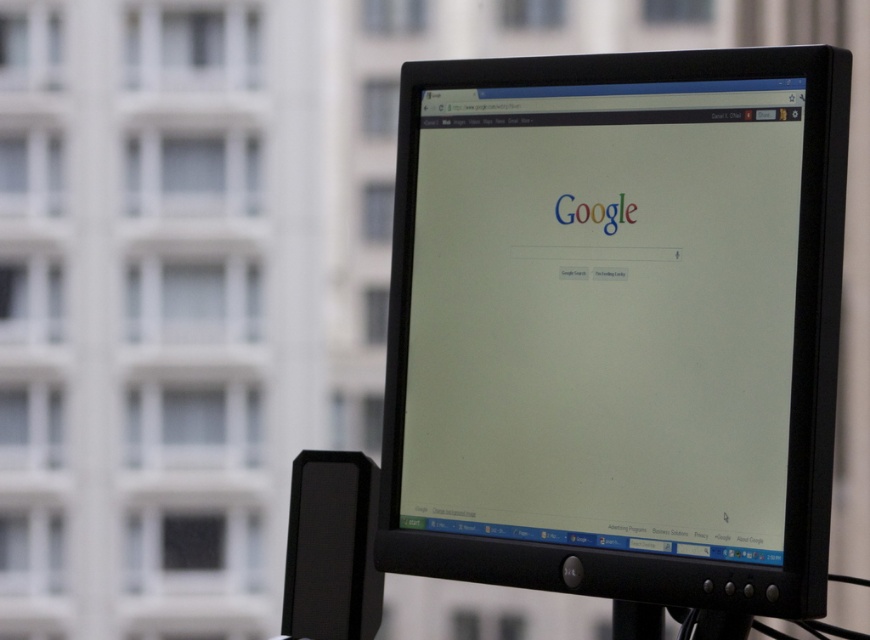
You are looking at the computer monitor displaying the Google homepage. The monitor is represented by the point at coordinates point (617,324). Where is the monitor located relative to the center of the image?

The black plastic monitor at center is located exactly at the coordinates point (617,324), which represents the center of the image.

You are setting up a new desk and want to place a small plant between the black plastic monitor at center and the black plastic pole at center. Given that the plant requires 15 cm of space, can you determine if there is enough space between them?

The black plastic monitor at center is much taller than the black plastic pole at center, but the description does not provide information about the distance between them. Therefore, it is impossible to determine if there is enough space for the plant requiring 15 cm of space between them.